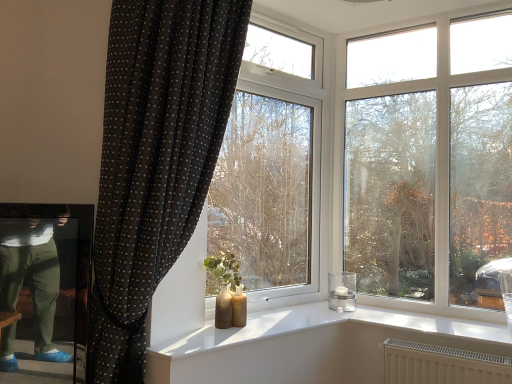
The width and height of the screenshot is (512, 384). I want to click on vacant point above transparent glass window at center (from a real-world perspective), so click(x=292, y=22).